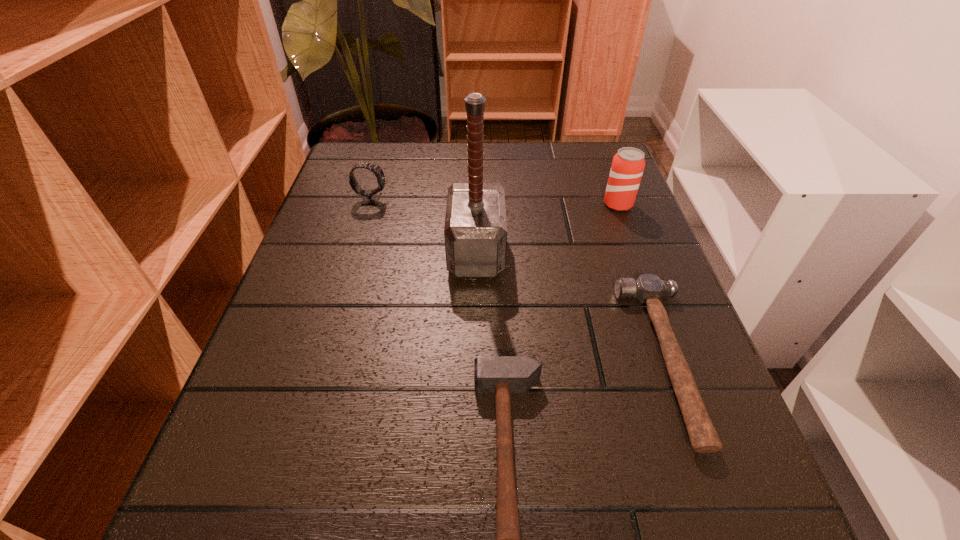
The width and height of the screenshot is (960, 540). In order to click on the third farthest object in this screenshot , I will do `click(475, 232)`.

Locate an element on the screen. The width and height of the screenshot is (960, 540). the tallest hammer is located at coordinates (475, 232).

Image resolution: width=960 pixels, height=540 pixels. I want to click on the second tallest object, so click(x=628, y=164).

Find the location of `watch`. watch is located at coordinates (369, 198).

Image resolution: width=960 pixels, height=540 pixels. Identify the location of the leftmost object. (369, 198).

Locate an element on the screen. the rightmost hammer is located at coordinates (648, 288).

Where is `vacant region located on the back of the tallest object`? The image size is (960, 540). vacant region located on the back of the tallest object is located at coordinates (477, 179).

At what (x,y) coordinates should I click in order to perform the action: click on free region located on the front of the beer can. Please return your answer as a coordinate pair (x, y). The height and width of the screenshot is (540, 960). Looking at the image, I should click on (663, 326).

In order to click on free region located 0.240m on the face of the third shortest object in this screenshot , I will do `click(492, 200)`.

You are a GUI agent. You are given a task and a screenshot of the screen. Output one action in this format:
    pyautogui.click(x=<x>, y=<y>)
    Task: Click on the vacant space located on the striking face of the rightmost hammer
    The image size is (960, 540).
    Given the screenshot: What is the action you would take?
    pyautogui.click(x=434, y=359)